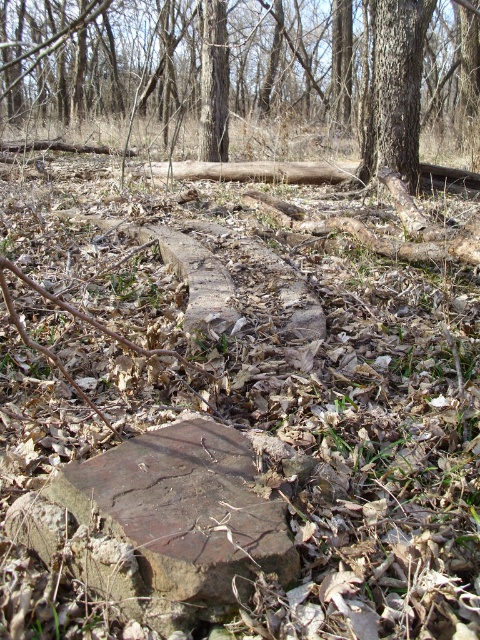
Question: Which is nearer to the smooth brown log at center?

Choices:
 (A) rough bark tree at upper center
 (B) brown rough stone at center

Answer: (B)

Question: Is smooth brown log at center further to camera compared to rough bark tree at upper center?

Choices:
 (A) no
 (B) yes

Answer: (A)

Question: Which point is closer to the camera taking this photo?

Choices:
 (A) (173, 458)
 (B) (377, 108)
 (C) (205, 38)

Answer: (A)

Question: Does smooth brown log at center appear over brown rough stone at center?

Choices:
 (A) no
 (B) yes

Answer: (B)

Question: Estimate the real-world distances between objects in this image. Which object is farther from the brown rough stone at center?

Choices:
 (A) rough bark tree at upper center
 (B) smooth brown log at center

Answer: (B)

Question: Can you confirm if smooth brown log at center is positioned to the right of brown rough stone at center?

Choices:
 (A) yes
 (B) no

Answer: (B)